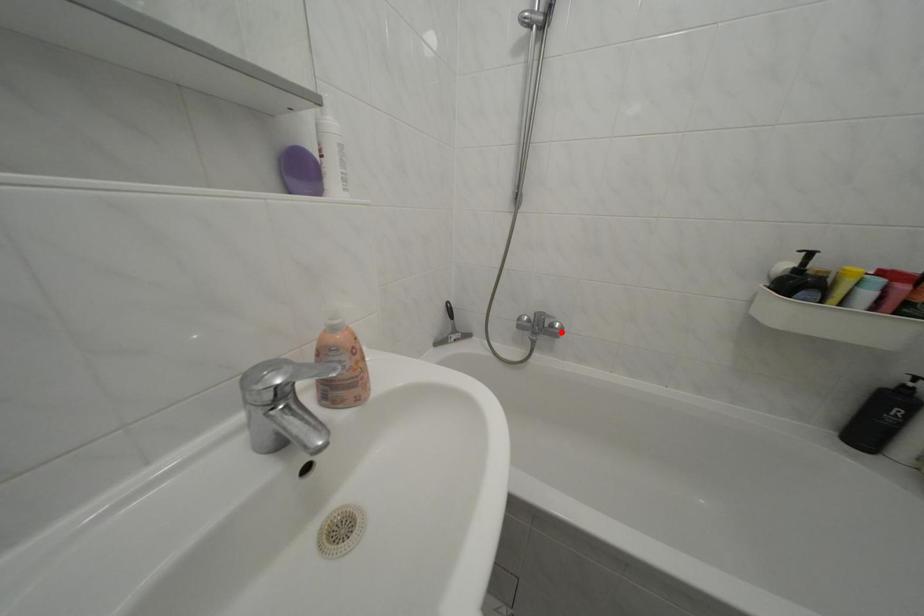
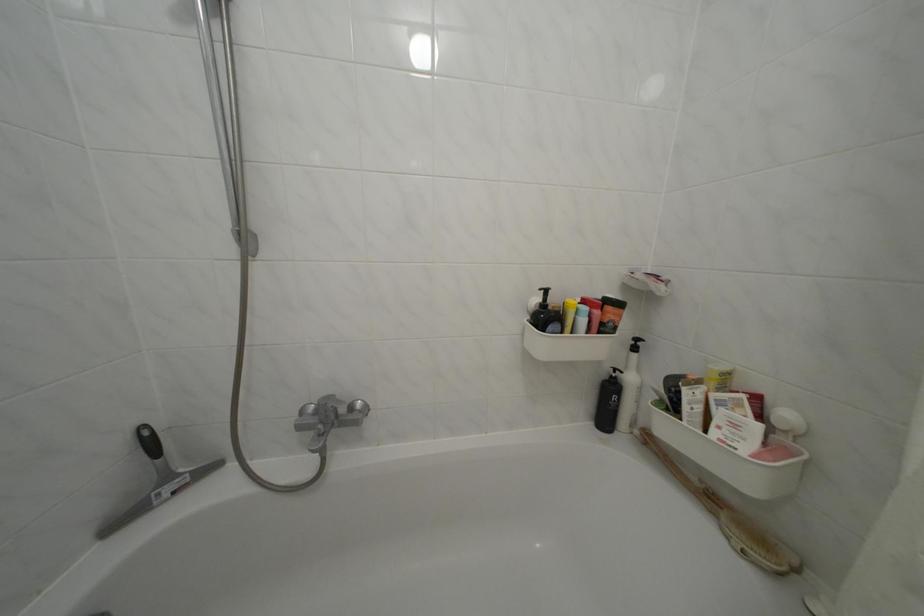
Locate, in the second image, the point that corresponds to the highlighted location in the first image.

(359, 414)